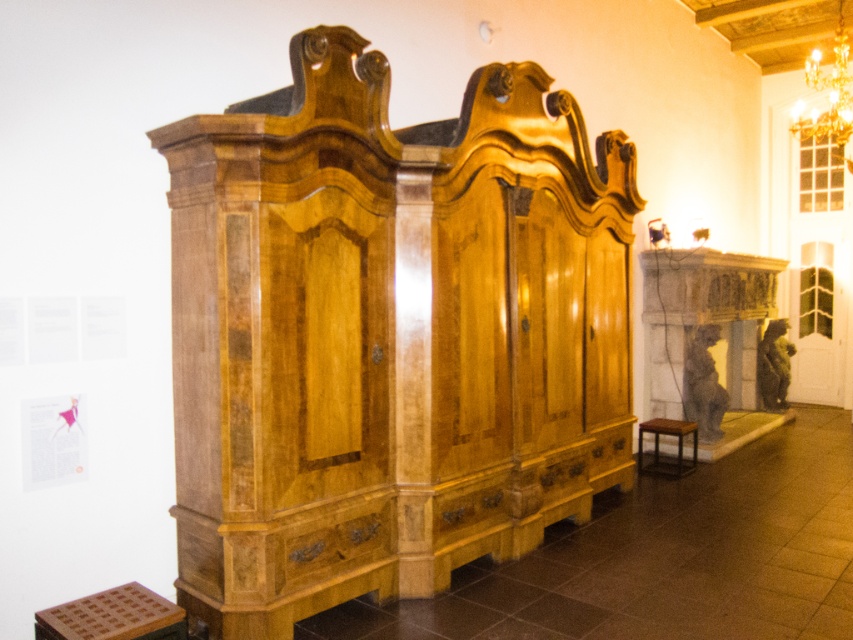
Between point (563, 172) and point (318, 566), which one is positioned behind?

The point (563, 172) is more distant.

Find the location of `glossy wood dresser at center`. glossy wood dresser at center is located at coordinates (390, 326).

Locate an element on the screen. This screenshot has height=640, width=853. glossy wood dresser at center is located at coordinates (390, 326).

Does shiny brown wood drawer at lower center come behind brown wooden stool at lower right?

No, shiny brown wood drawer at lower center is in front of brown wooden stool at lower right.

Can you confirm if shiny brown wood drawer at lower center is bigger than brown wooden stool at lower right?

No.

Which is behind, point (347, 557) or point (688, 432)?

The point (688, 432) is more distant.

The width and height of the screenshot is (853, 640). In order to click on shiny brown wood drawer at lower center in this screenshot , I will do (334, 545).

Between point (268, 180) and point (674, 433), which one is positioned in front?

Point (268, 180)

What do you see at coordinates (390, 326) in the screenshot?
I see `glossy wood dresser at center` at bounding box center [390, 326].

You are a GUI agent. You are given a task and a screenshot of the screen. Output one action in this format:
    pyautogui.click(x=<x>, y=<y>)
    Task: Click on the glossy wood dresser at center
    The width and height of the screenshot is (853, 640).
    Given the screenshot: What is the action you would take?
    pyautogui.click(x=390, y=326)